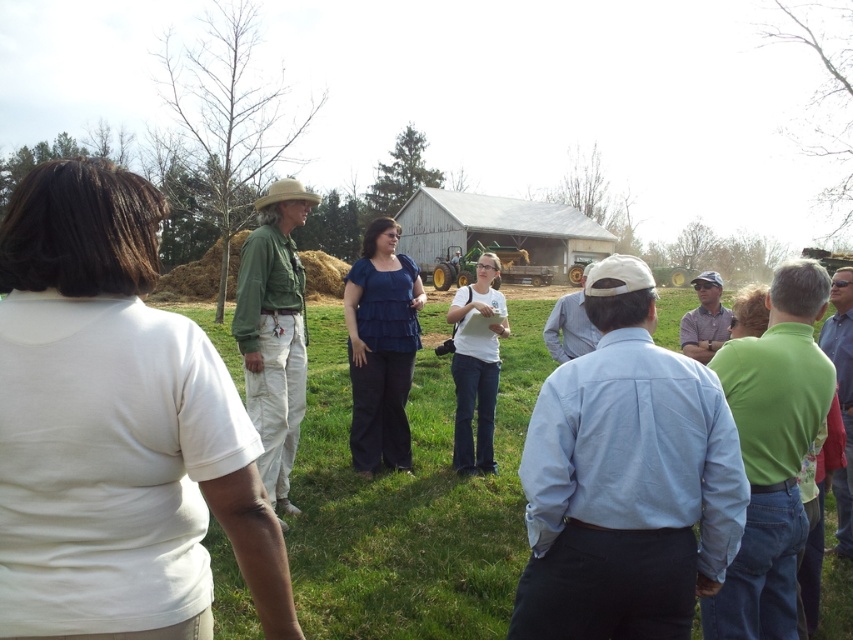
Who is lower down, blue fabric blouse at center or white cotton shirt at center?

white cotton shirt at center

Is point (367, 353) farther from camera compared to point (473, 388)?

No, (367, 353) is in front of (473, 388).

The image size is (853, 640). I want to click on blue fabric blouse at center, so click(381, 348).

I want to click on blue fabric blouse at center, so click(381, 348).

Can you confirm if green grass at center is positioned above green cotton shirt at center?

Actually, green grass at center is below green cotton shirt at center.

From the picture: Is green grass at center positioned at the back of green cotton shirt at center?

That is False.

Does point (500, 632) come closer to viewer compared to point (280, 323)?

Yes.

At what (x,y) coordinates should I click in order to perform the action: click on green grass at center. Please return your answer as a coordinate pair (x, y). The height and width of the screenshot is (640, 853). Looking at the image, I should click on (410, 499).

Can you confirm if green grass at center is shorter than blue fabric blouse at center?

Yes, green grass at center is shorter than blue fabric blouse at center.

Between green grass at center and blue fabric blouse at center, which one appears on the left side from the viewer's perspective?

blue fabric blouse at center is more to the left.

Does point (509, 376) come in front of point (386, 244)?

No.

Where is `green grass at center`? This screenshot has width=853, height=640. green grass at center is located at coordinates (410, 499).